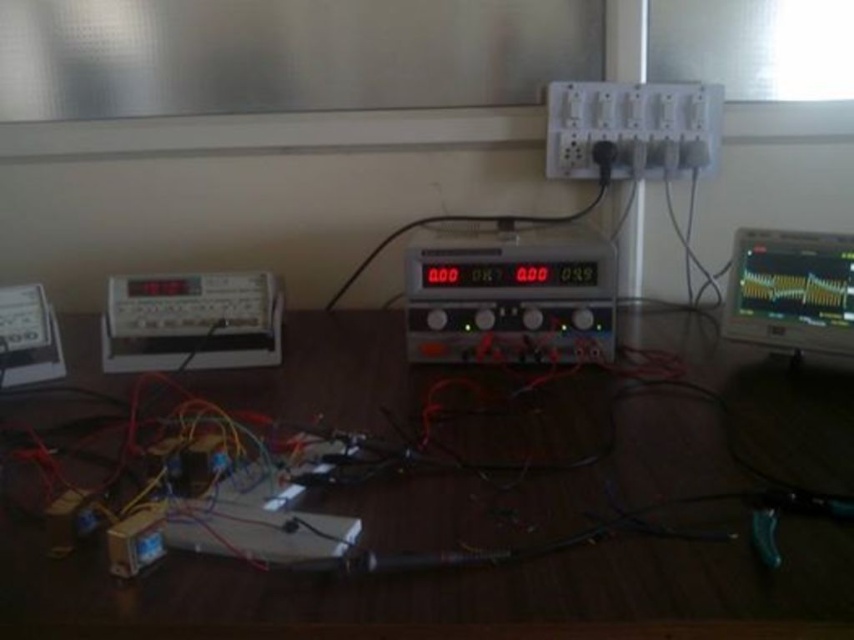
Question: Which of these objects is positioned closest to the wooden table at center?

Choices:
 (A) matte gray digital meter at left
 (B) matte black monitor at right
 (C) black plastic multimeter at center

Answer: (C)

Question: Which point appears farthest from the camera in this image?

Choices:
 (A) (835, 300)
 (B) (153, 314)
 (C) (412, 410)
 (D) (554, 308)

Answer: (B)

Question: Does wooden table at center appear under black plastic multimeter at center?

Choices:
 (A) no
 (B) yes

Answer: (B)

Question: Does wooden table at center appear on the left side of black plastic multimeter at center?

Choices:
 (A) no
 (B) yes

Answer: (B)

Question: Is wooden table at center to the left of matte black monitor at right from the viewer's perspective?

Choices:
 (A) yes
 (B) no

Answer: (A)

Question: Among these objects, which one is farthest from the camera?

Choices:
 (A) matte black monitor at right
 (B) wooden table at center
 (C) black plastic multimeter at center
 (D) matte gray digital meter at left

Answer: (D)